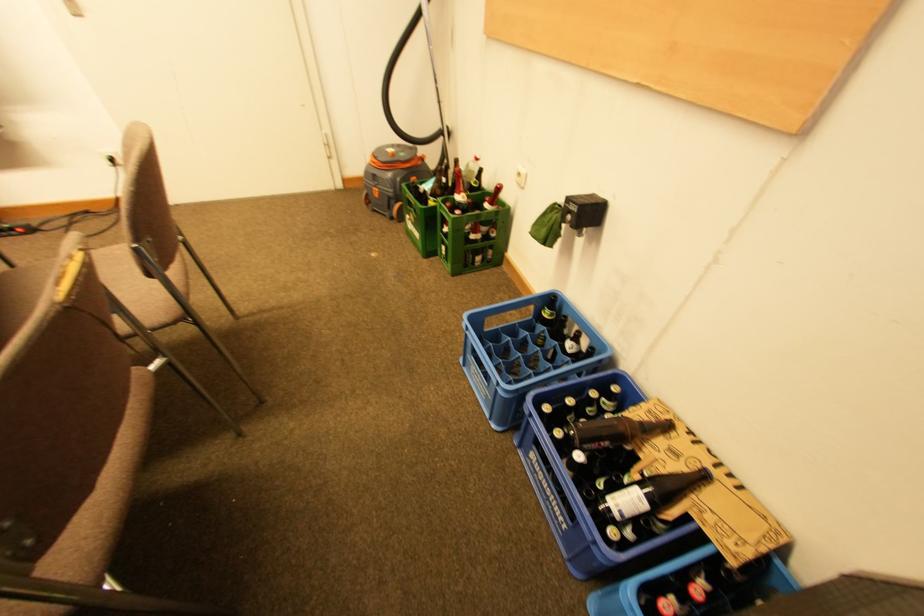
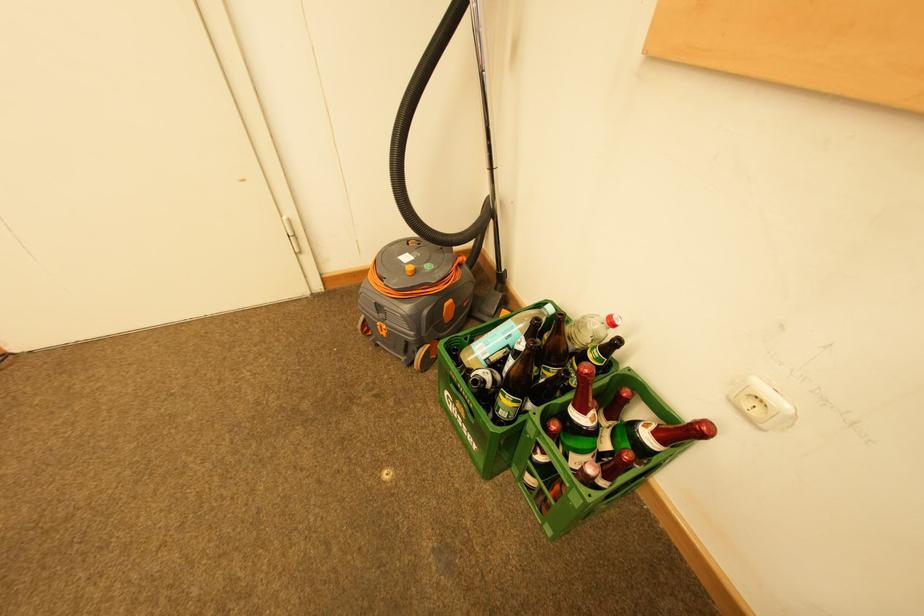
Question: Which direction would the cameraman need to move to produce the second image? Reply with the corresponding letter.

Choices:
 (A) Left
 (B) Right
 (C) Forward
 (D) Backward

Answer: (C)